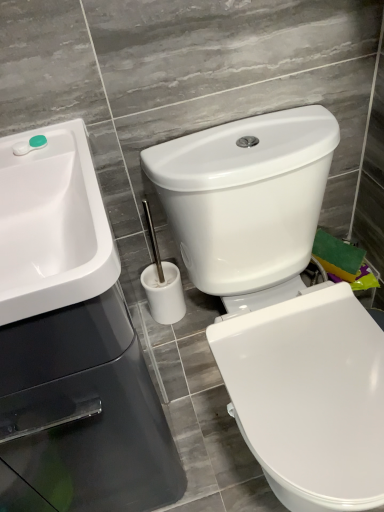
You are a GUI agent. You are given a task and a screenshot of the screen. Output one action in this format:
    pyautogui.click(x=<x>, y=<y>)
    Task: Click on the white glossy sink at upper left
    Image resolution: width=384 pixels, height=512 pixels.
    Given the screenshot: What is the action you would take?
    pyautogui.click(x=52, y=225)

Where is `white glossy toilet at center`? white glossy toilet at center is located at coordinates (279, 302).

Is white glossy sink at upper left bigger than green plastic container at upper left?

Yes, white glossy sink at upper left is bigger than green plastic container at upper left.

Is white glossy sink at upper left taller or shorter than green plastic container at upper left?

Clearly, white glossy sink at upper left is taller compared to green plastic container at upper left.

Is white glossy sink at upper left to the left or to the right of green plastic container at upper left in the image?

white glossy sink at upper left is to the right of green plastic container at upper left.

Is white glossy sink at upper left oriented away from white glossy toilet at center?

No.

Based on the photo, which point is more distant from viewer, (66,261) or (358,478)?

Point (358,478)

Does white glossy sink at upper left have a greater height compared to white glossy toilet at center?

No.

In the image, is white glossy sink at upper left positioned in front of or behind white glossy toilet at center?

white glossy sink at upper left is behind white glossy toilet at center.

Does white glossy toilet at center touch white glossy sink at upper left?

white glossy toilet at center is not next to white glossy sink at upper left, and they're not touching.

From the picture: Considering the relative sizes of white glossy toilet at center and white glossy sink at upper left in the image provided, is white glossy toilet at center bigger than white glossy sink at upper left?

Yes.

Is white glossy toilet at center outside of white glossy sink at upper left?

That's correct, white glossy toilet at center is outside of white glossy sink at upper left.

Is green plastic container at upper left beside white glossy sink at upper left?

No, green plastic container at upper left is not touching white glossy sink at upper left.

Is green plastic container at upper left facing towards white glossy sink at upper left?

Yes.

Visually, is green plastic container at upper left positioned to the left or to the right of white glossy sink at upper left?

In the image, green plastic container at upper left appears on the left side of white glossy sink at upper left.

Considering the relative sizes of green plastic container at upper left and white glossy sink at upper left in the image provided, is green plastic container at upper left taller than white glossy sink at upper left?

No.

From the picture: From the image's perspective, between green plastic container at upper left and white glossy toilet at center, who is located below?

white glossy toilet at center is shown below in the image.

Are green plastic container at upper left and white glossy toilet at center located far from each other?

Actually, green plastic container at upper left and white glossy toilet at center are a little close together.

Could you tell me if green plastic container at upper left is facing white glossy toilet at center?

No, green plastic container at upper left is not facing towards white glossy toilet at center.

Is white glossy toilet at center placed right next to green plastic container at upper left?

white glossy toilet at center is not next to green plastic container at upper left, and they're not touching.

Does white glossy toilet at center have a larger size compared to green plastic container at upper left?

Indeed, white glossy toilet at center has a larger size compared to green plastic container at upper left.

From the image's perspective, would you say white glossy toilet at center is shown under green plastic container at upper left?

Indeed, from the image's perspective, white glossy toilet at center is shown beneath green plastic container at upper left.

Find the location of a particular element. This screenshot has width=384, height=512. sink below the green plastic container at upper left (from a real-world perspective) is located at coordinates (52, 225).

This screenshot has width=384, height=512. Find the location of `toilet in front of the white glossy sink at upper left`. toilet in front of the white glossy sink at upper left is located at coordinates (279, 302).

Which object lies nearer to the anchor point white glossy toilet at center, green plastic container at upper left or white glossy sink at upper left?

Based on the image, white glossy sink at upper left appears to be nearer to white glossy toilet at center.

From the image, which object appears to be nearer to white glossy sink at upper left, white glossy toilet at center or green plastic container at upper left?

green plastic container at upper left is positioned closer to the anchor white glossy sink at upper left.

Consider the image. Looking at the image, which one is located closer to white glossy toilet at center, white glossy sink at upper left or green plastic container at upper left?

Among the two, white glossy sink at upper left is located nearer to white glossy toilet at center.

Looking at the image, which one is located closer to green plastic container at upper left, white glossy toilet at center or white glossy sink at upper left?

white glossy sink at upper left.

Considering their positions, is green plastic container at upper left positioned closer to white glossy sink at upper left than white glossy toilet at center?

green plastic container at upper left.

Based on their spatial positions, is white glossy sink at upper left or white glossy toilet at center further from green plastic container at upper left?

white glossy toilet at center is further to green plastic container at upper left.

Locate an element on the screen. sink located between green plastic container at upper left and white glossy toilet at center in the left-right direction is located at coordinates (52, 225).